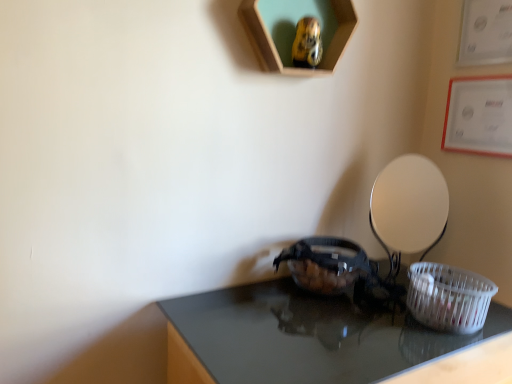
Question: Considering the positions of white plastic basket at lower right and shiny black table at center in the image, is white plastic basket at lower right taller or shorter than shiny black table at center?

Choices:
 (A) short
 (B) tall

Answer: (A)

Question: In the image, is white plastic basket at lower right positioned in front of or behind shiny black table at center?

Choices:
 (A) front
 (B) behind

Answer: (B)

Question: Is point (430, 316) closer or farther from the camera than point (294, 304)?

Choices:
 (A) farther
 (B) closer

Answer: (B)

Question: Considering the positions of shiny black table at center and white plastic basket at lower right in the image, is shiny black table at center taller or shorter than white plastic basket at lower right?

Choices:
 (A) tall
 (B) short

Answer: (A)

Question: Based on their sizes in the image, would you say shiny black table at center is bigger or smaller than white plastic basket at lower right?

Choices:
 (A) small
 (B) big

Answer: (B)

Question: Based on their positions, is shiny black table at center located to the left or right of white plastic basket at lower right?

Choices:
 (A) right
 (B) left

Answer: (B)

Question: Is shiny black table at center in front of or behind white plastic basket at lower right in the image?

Choices:
 (A) behind
 (B) front

Answer: (B)